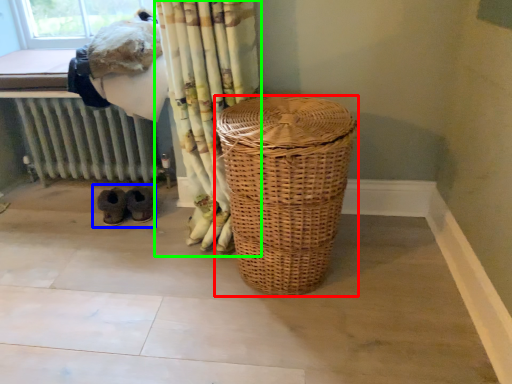
Question: Considering the real-world distances, which object is closest to laundry basket (highlighted by a red box)? footwear (highlighted by a blue box) or curtain (highlighted by a green box).

Choices:
 (A) footwear
 (B) curtain

Answer: (B)